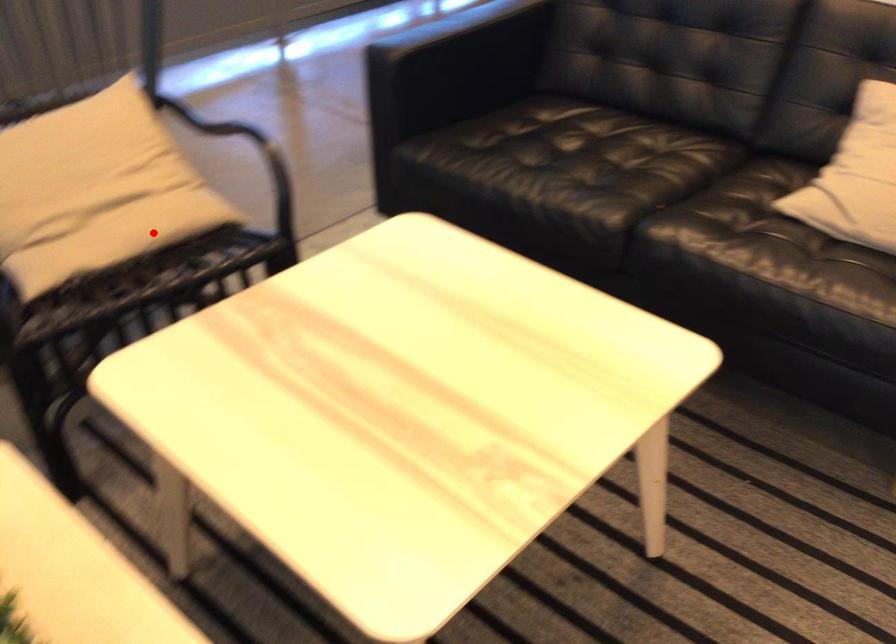
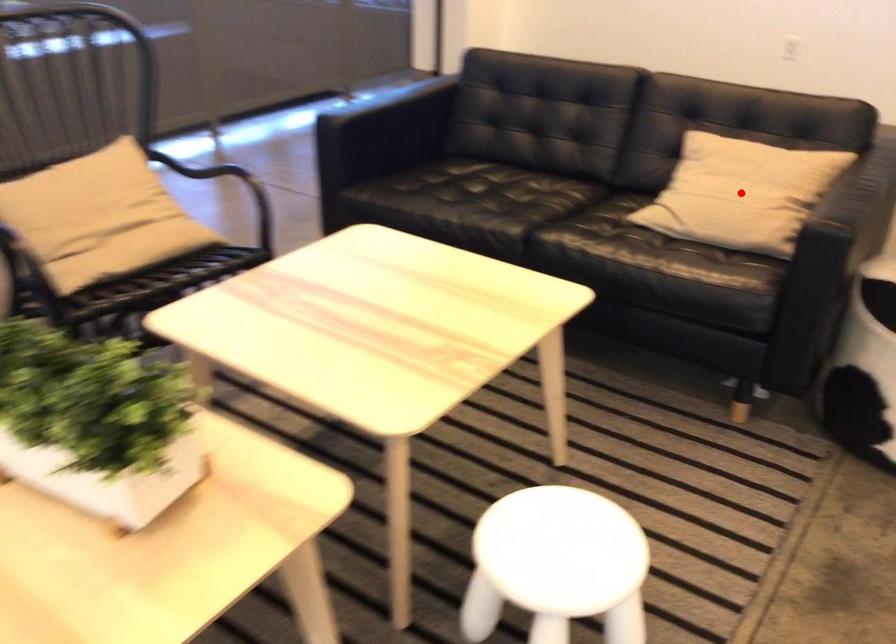
I am providing you with two images of the same scene from different viewpoints. A red point is marked on the first image and another point is marked on the second image. Is the marked point in image1 the same physical position as the marked point in image2?

No